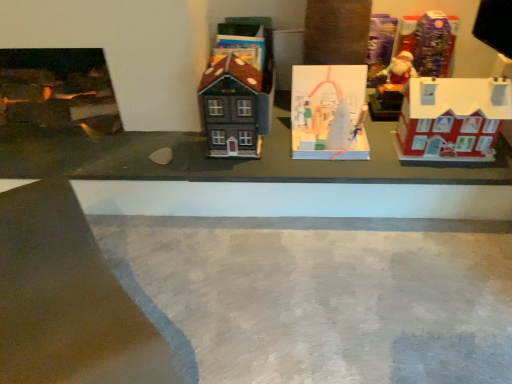
Question: From a real-world perspective, is matte red house at right, placed as the 2th toy when sorted from right to left, positioned over gray concrete at center based on gravity?

Choices:
 (A) no
 (B) yes

Answer: (B)

Question: Does matte red house at right, the 4th toy when ordered from left to right, lie in front of gray concrete at center?

Choices:
 (A) no
 (B) yes

Answer: (A)

Question: Is matte red house at right, the 4th toy when ordered from left to right, to the right of gray concrete at center from the viewer's perspective?

Choices:
 (A) yes
 (B) no

Answer: (A)

Question: Is matte red house at right, the 4th toy when ordered from left to right, next to gray concrete at center?

Choices:
 (A) no
 (B) yes

Answer: (A)

Question: Is matte red house at right, the 4th toy when ordered from left to right, to the left of gray concrete at center from the viewer's perspective?

Choices:
 (A) yes
 (B) no

Answer: (B)

Question: In terms of width, does white paper ornament at center, which is counted as the 4th toy, starting from the right, look wider or thinner when compared to matte red house at right, the 4th toy when ordered from left to right?

Choices:
 (A) thin
 (B) wide

Answer: (B)

Question: Is point (320, 132) positioned closer to the camera than point (415, 152)?

Choices:
 (A) closer
 (B) farther

Answer: (B)

Question: Do you think white paper ornament at center, which is counted as the 4th toy, starting from the right, is within matte red house at right, placed as the 2th toy when sorted from right to left, or outside of it?

Choices:
 (A) inside
 (B) outside

Answer: (B)

Question: From the image's perspective, is white paper ornament at center, acting as the second toy starting from the left, positioned above or below matte red house at right, the 4th toy when ordered from left to right?

Choices:
 (A) below
 (B) above

Answer: (B)

Question: Is matte red house at right, the 4th toy when ordered from left to right, wider or thinner than white paper ornament at center, which is counted as the 4th toy, starting from the right?

Choices:
 (A) wide
 (B) thin

Answer: (B)

Question: In the image, is matte red house at right, placed as the 2th toy when sorted from right to left, on the left side or the right side of white paper ornament at center, acting as the second toy starting from the left?

Choices:
 (A) left
 (B) right

Answer: (B)

Question: Would you say matte red house at right, the 4th toy when ordered from left to right, is inside or outside white paper ornament at center, acting as the second toy starting from the left?

Choices:
 (A) outside
 (B) inside

Answer: (A)

Question: Is matte red house at right, placed as the 2th toy when sorted from right to left, taller or shorter than white paper ornament at center, which is counted as the 4th toy, starting from the right?

Choices:
 (A) short
 (B) tall

Answer: (B)

Question: Based on their positions, is shiny plastic santa at upper right, which appears as the 5th toy when viewed from the left, located to the left or right of matte brown house at center, placed as the fifth toy when sorted from right to left?

Choices:
 (A) right
 (B) left

Answer: (A)

Question: In the image, is shiny plastic santa at upper right, marked as the 1th toy in a right-to-left arrangement, positioned in front of or behind matte brown house at center, placed as the fifth toy when sorted from right to left?

Choices:
 (A) behind
 (B) front

Answer: (A)